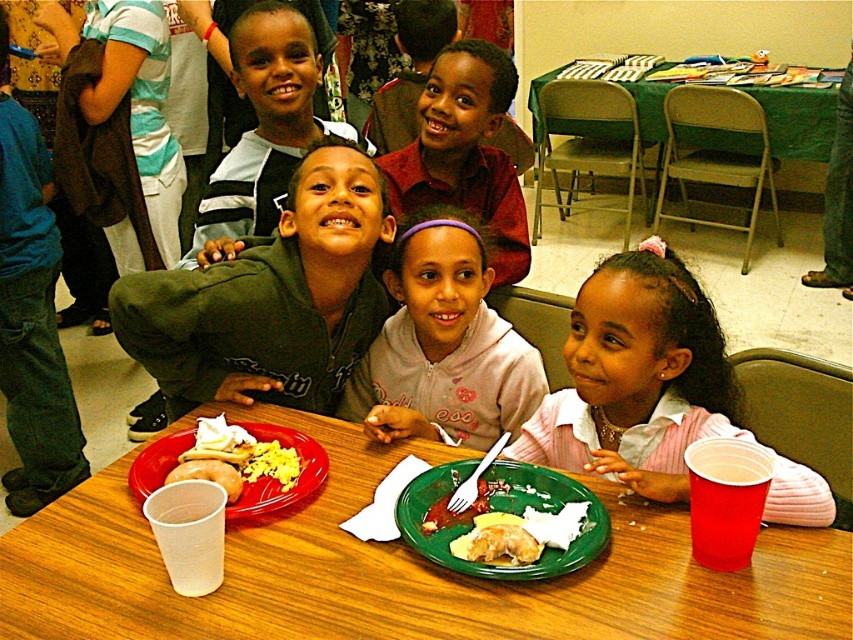
You are a teacher organizing a classroom activity and need to fit both the pink fleece hoodie at center and the yellowish matte bread at center into a storage box. The box can only accommodate items up to the size of the larger object. Which object determines the minimum required box size?

The pink fleece hoodie at center determines the minimum required box size because its width is larger than the yellowish matte bread at center.

Looking at this image, you are a teacher organizing a classroom activity. You need to place the pink fleece hoodie at center and the yellowish matte bread at center into a storage box. The box can only hold items that are smaller than the hoodie. Will both items fit?

The pink fleece hoodie at center is bigger than the yellowish matte bread at center. Therefore, the hoodie cannot fit into the box, but the bread might fit since it is smaller.